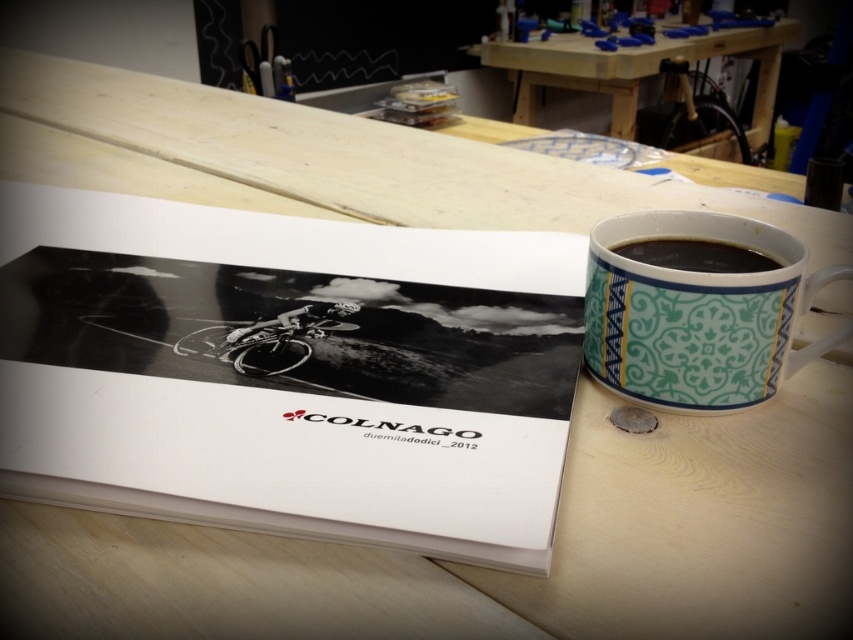
Looking at this image, does white paper book at center have a greater width compared to teal ceramic mug at right?

Yes, white paper book at center is wider than teal ceramic mug at right.

Who is positioned more to the left, white paper book at center or teal ceramic mug at right?

From the viewer's perspective, white paper book at center appears more on the left side.

Between point (318, 504) and point (817, 352), which one is positioned behind?

Point (817, 352)

The height and width of the screenshot is (640, 853). I want to click on white paper book at center, so click(x=288, y=401).

Can you confirm if teal ceramic mug at right is thinner than black glossy mug at upper right?

No, teal ceramic mug at right is not thinner than black glossy mug at upper right.

Is teal ceramic mug at right taller than black glossy mug at upper right?

Correct, teal ceramic mug at right is much taller as black glossy mug at upper right.

Describe the element at coordinates (698, 314) in the screenshot. I see `teal ceramic mug at right` at that location.

Where is `teal ceramic mug at right`? The width and height of the screenshot is (853, 640). teal ceramic mug at right is located at coordinates (698, 314).

How much distance is there between white paper book at center and black glossy mug at upper right?

white paper book at center and black glossy mug at upper right are 7.64 inches apart from each other.

Does white paper book at center have a larger size compared to black glossy mug at upper right?

Yes, white paper book at center is bigger than black glossy mug at upper right.

Which is behind, point (305, 524) or point (637, 246)?

The point (637, 246) is behind.

Image resolution: width=853 pixels, height=640 pixels. Find the location of `white paper book at center`. white paper book at center is located at coordinates (288, 401).